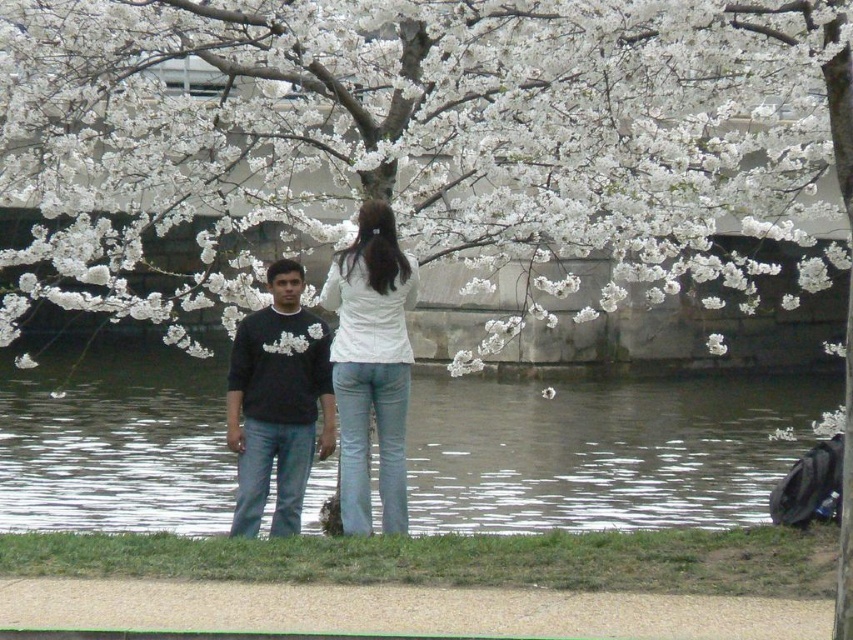
Question: Which point is closer to the camera?

Choices:
 (A) (358, 218)
 (B) (242, 216)
 (C) (239, 346)

Answer: (A)

Question: Is white blossoms at center bigger than clear water at center?

Choices:
 (A) no
 (B) yes

Answer: (A)

Question: Is white blossoms at center smaller than black matte sweater at center?

Choices:
 (A) yes
 (B) no

Answer: (A)

Question: Which point is closer to the camera?

Choices:
 (A) white matte shirt at center
 (B) white blossoms at center
 (C) clear water at center
 (D) black matte sweater at center

Answer: (A)

Question: Is white matte shirt at center above black matte sweater at center?

Choices:
 (A) yes
 (B) no

Answer: (A)

Question: Which of the following is the closest to the observer?

Choices:
 (A) (363, 467)
 (B) (662, 408)

Answer: (A)